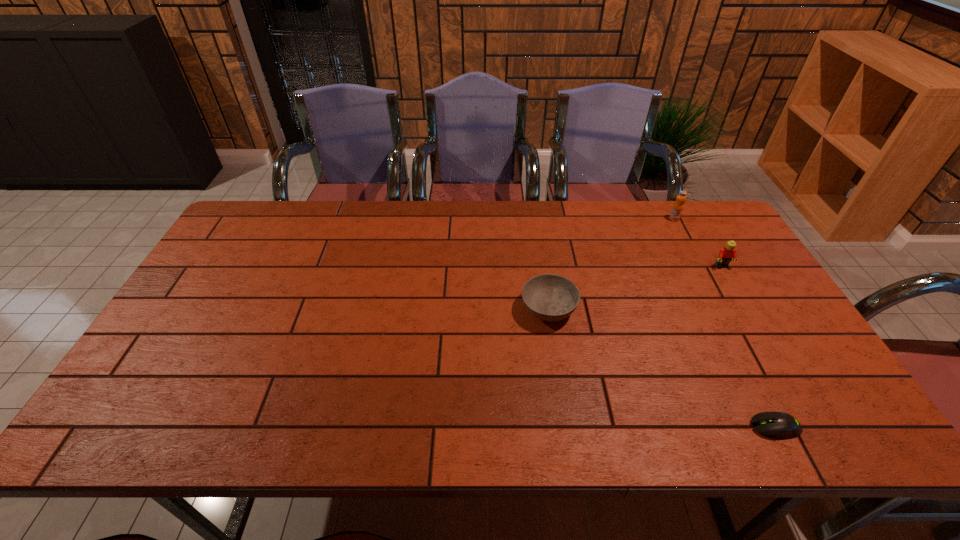
At what (x,y) coordinates should I click in order to perform the action: click on free space at the far edge. Please return your answer as a coordinate pair (x, y). Image resolution: width=960 pixels, height=540 pixels. Looking at the image, I should click on (545, 203).

The image size is (960, 540). Identify the location of free region at the near edge of the desktop. (180, 424).

In the image, there is a desktop. Identify the location of vacant space at the left edge. (256, 266).

In order to click on free spot at the far left corner of the desktop in this screenshot , I will do `click(276, 200)`.

Find the location of a particular element. free location at the far right corner of the desktop is located at coordinates (729, 238).

Find the location of a particular element. free space between the third nearest object and the bowl is located at coordinates coord(636,288).

The height and width of the screenshot is (540, 960). Identify the location of vacant area that lies between the third tallest object and the rightmost object. (636, 288).

The height and width of the screenshot is (540, 960). Find the location of `unoccupied position between the nearest object and the third tallest object`. unoccupied position between the nearest object and the third tallest object is located at coordinates (661, 368).

Where is `free spot between the orange juice and the rightmost object`? free spot between the orange juice and the rightmost object is located at coordinates (698, 242).

I want to click on vacant point located between the second tallest object and the orange juice, so 698,242.